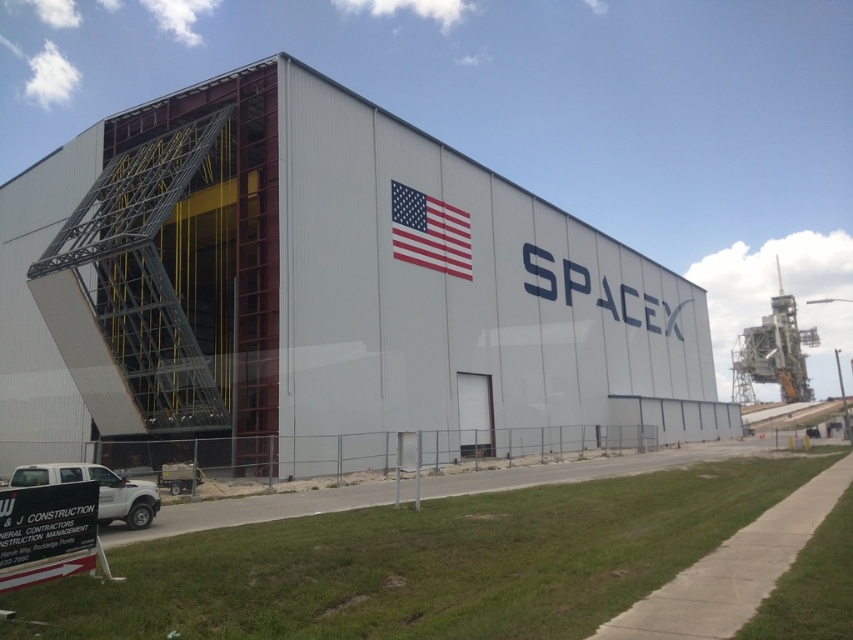
Who is more distant from viewer, [439,227] or [117,481]?

Result: Positioned behind is point [439,227].

Is point (459, 236) positioned in front of point (148, 493)?

That is False.

Locate an element on the screen. american flag at center is located at coordinates point(428,230).

Is white matte hangar at center positioned before white matte truck at lower left?

No.

Does white matte hangar at center have a larger size compared to white matte truck at lower left?

Correct, white matte hangar at center is larger in size than white matte truck at lower left.

Is point (85, 225) more distant than point (117, 499)?

Yes, point (85, 225) is farther from viewer.

Find the location of `white matte hangar at center`. white matte hangar at center is located at coordinates pyautogui.click(x=318, y=298).

What do you see at coordinates (318, 298) in the screenshot? I see `white matte hangar at center` at bounding box center [318, 298].

Who is positioned more to the left, white matte hangar at center or american flag at center?

From the viewer's perspective, american flag at center appears more on the left side.

Is point (340, 218) positioned in front of point (461, 248)?

That is True.

This screenshot has height=640, width=853. In order to click on white matte hangar at center in this screenshot , I will do `click(318, 298)`.